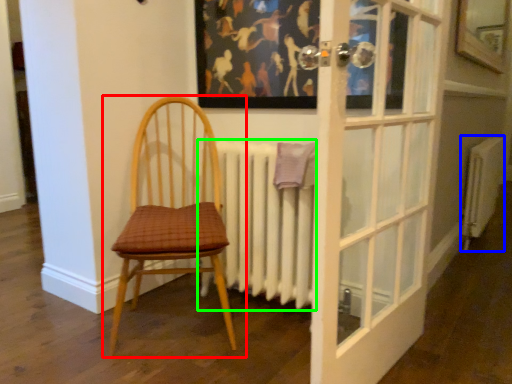
Question: Which is nearer to the chair (highlighted by a red box)? radiator (highlighted by a blue box) or radiator (highlighted by a green box).

Choices:
 (A) radiator
 (B) radiator

Answer: (B)